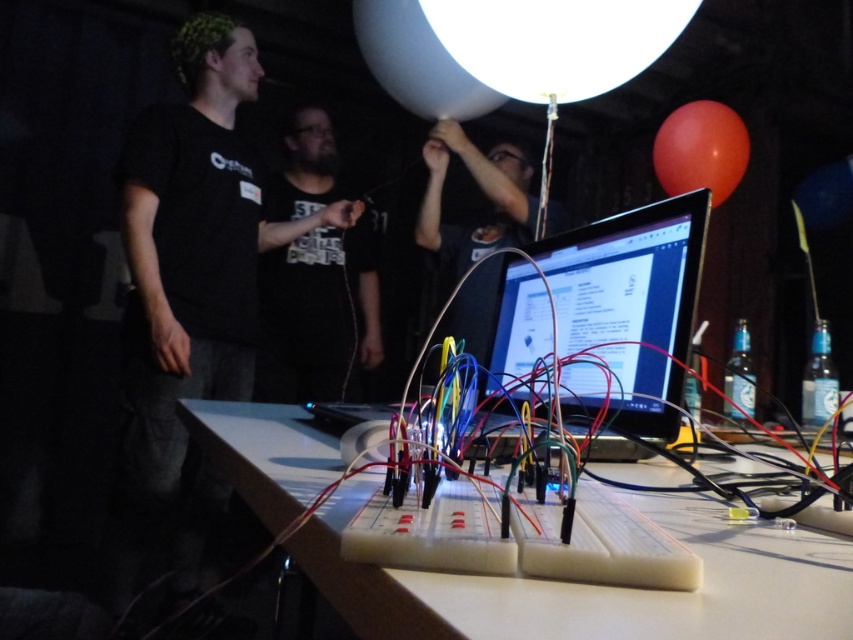
You are standing in the workshop scene. There is a point labeled as point (317, 314). What object is located at that point?

The point (317, 314) corresponds to the black matte t shirt at center.

You are at a workshop and see the white glossy balloon at upper center and the rubber balloon at upper right. Which one is wider?

The white glossy balloon at upper center might be wider than the rubber balloon at upper right.